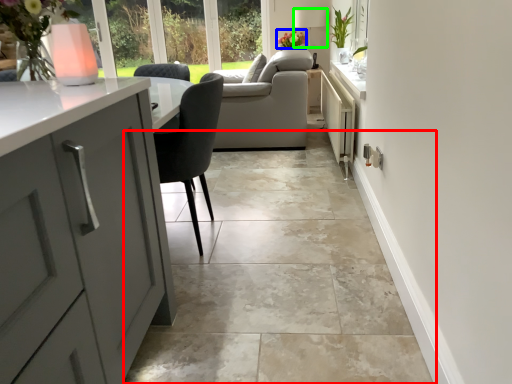
Question: Estimate the real-world distances between objects in this image. Which object is closer to ceramic tile (highlighted by a red box), flower (highlighted by a blue box) or lamp (highlighted by a green box)?

Choices:
 (A) flower
 (B) lamp

Answer: (A)